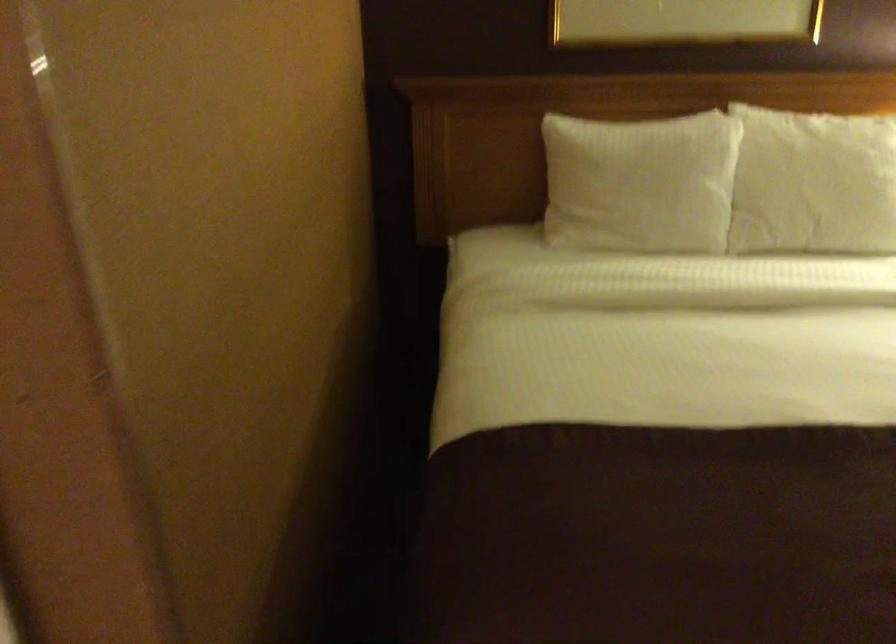
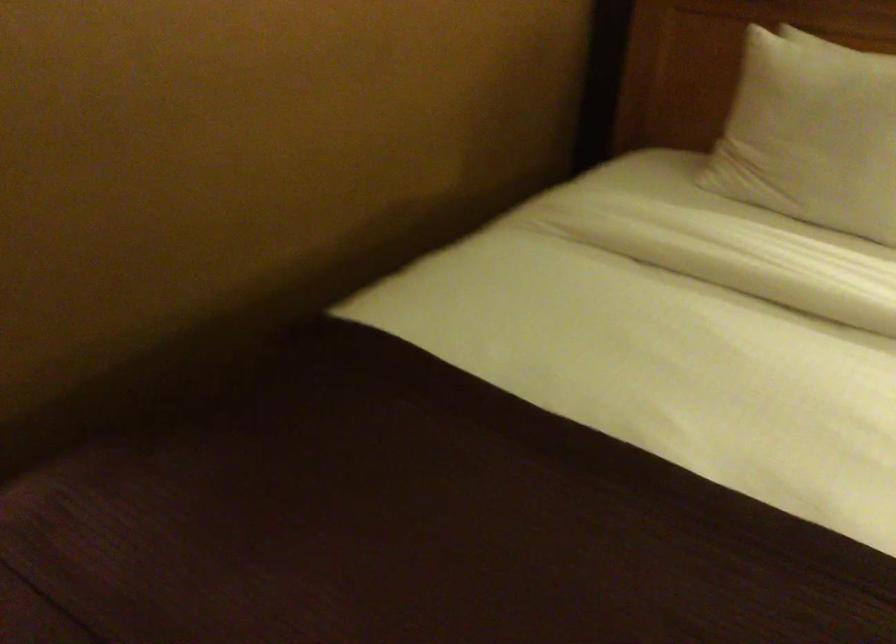
Question: The camera is either moving clockwise (left) or counter-clockwise (right) around the object. The first image is from the beginning of the video and the second image is from the end. Is the camera moving left or right when shooting the video?

Choices:
 (A) Left
 (B) Right

Answer: (B)